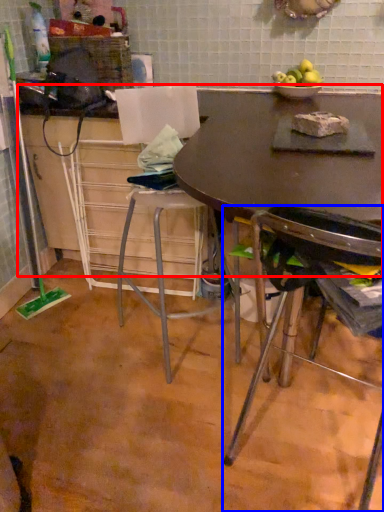
Question: Which object appears closest to the camera in this image, counter top (highlighted by a red box) or chair (highlighted by a blue box)?

Choices:
 (A) counter top
 (B) chair

Answer: (B)